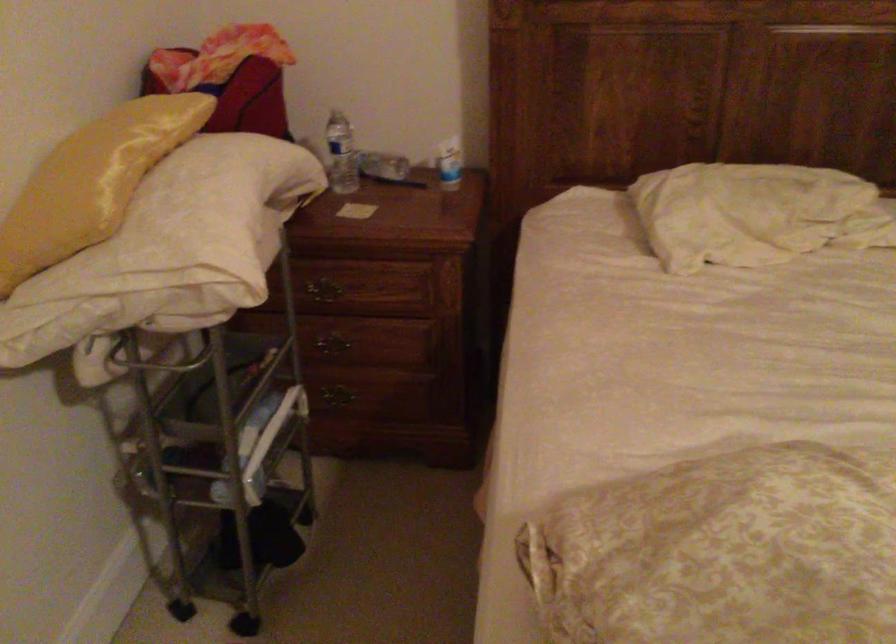
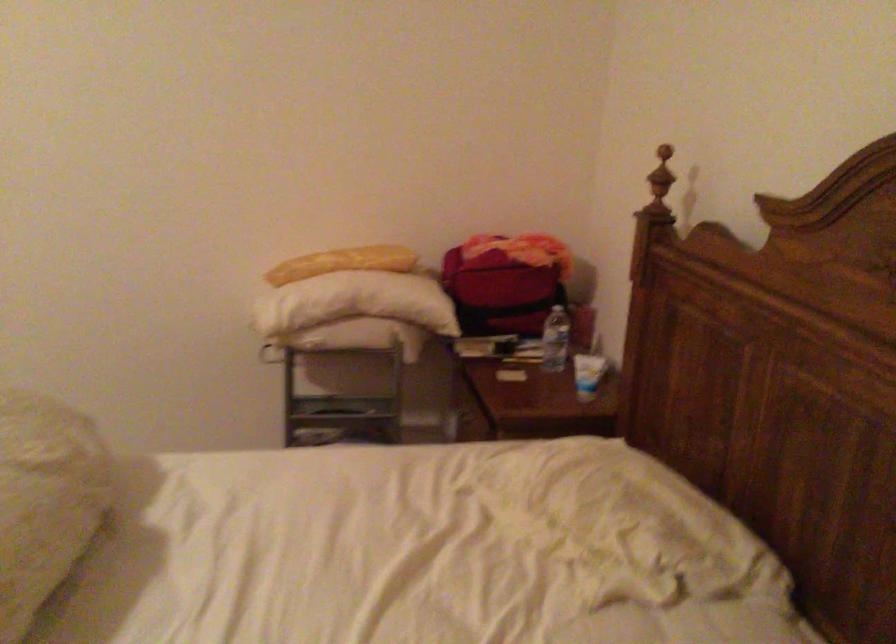
Find the pixel in the second image that matches [142,158] in the first image.

(342, 263)